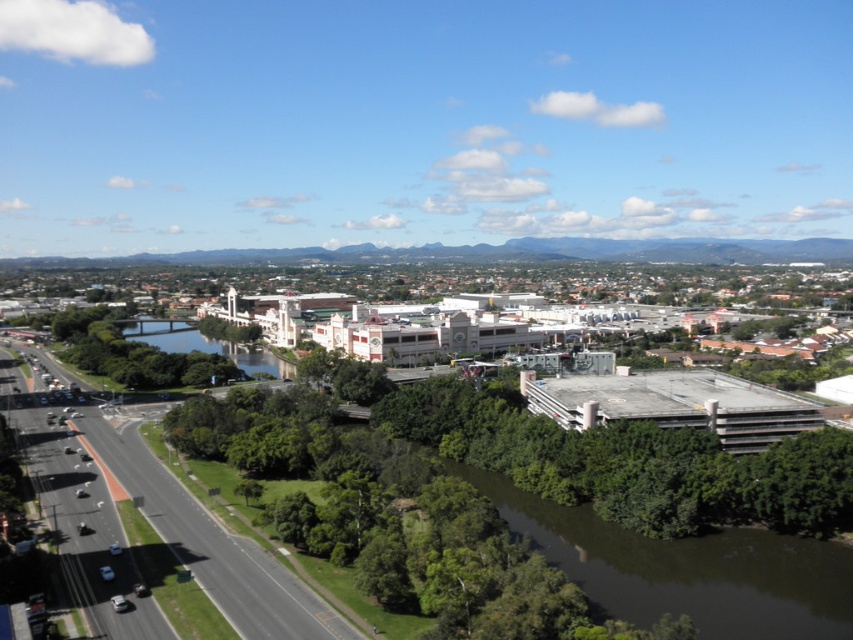
You are a drone operator trying to capture aerial footage of the suburban area. You have two points marked on your screen at coordinates point (x=238, y=355) and point (x=231, y=340). Which point should you focus on first if you want to ensure you capture the closest part of the scene first?

Point (x=238, y=355) is closer to the camera than point (x=231, y=340), so you should focus on point (x=238, y=355) first to capture the closest part of the scene.

You are a drone operator trying to capture a photo of the green reflective water at center and the green leafy tree at center from above. Which object will appear larger in the photo?

The green reflective water at center will appear larger in the photo because it is taller than the green leafy tree at center.

You are a drone operator tasked with capturing aerial footage. You notice the green murky water at lower center and the green leafy tree at center in your camera view. Which object appears taller in the frame?

The green leafy tree at center appears taller than the green murky water at lower center in the frame.